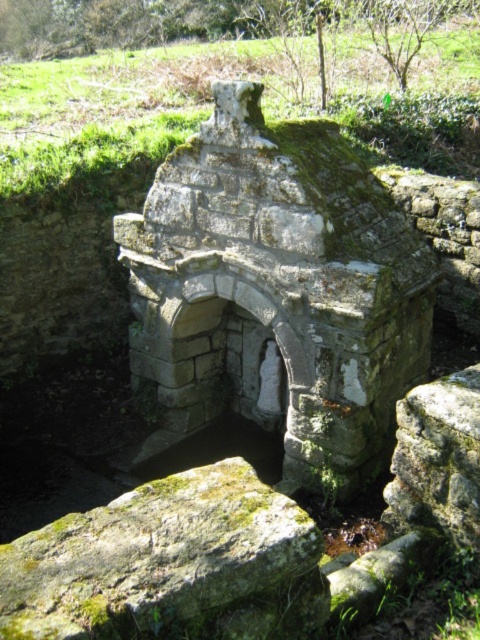
Does green mossy rock at lower left have a greater width compared to green mossy rock at center?

Indeed, green mossy rock at lower left has a greater width compared to green mossy rock at center.

Is green mossy rock at lower left below green mossy rock at center?

Correct, green mossy rock at lower left is located below green mossy rock at center.

Which is behind, point (300, 588) or point (453, 436)?

Positioned behind is point (453, 436).

At what (x,y) coordinates should I click in order to perform the action: click on green mossy rock at lower left. Please return your answer as a coordinate pair (x, y). This screenshot has width=480, height=640. Looking at the image, I should click on (170, 564).

Between green mossy stone at center and green mossy rock at center, which one has more height?

Standing taller between the two is green mossy stone at center.

Image resolution: width=480 pixels, height=640 pixels. What do you see at coordinates (277, 291) in the screenshot?
I see `green mossy stone at center` at bounding box center [277, 291].

What are the coordinates of `green mossy stone at center` in the screenshot? It's located at (277, 291).

How much distance is there between green mossy stone at center and green mossy rock at lower left?

green mossy stone at center is 6.98 feet from green mossy rock at lower left.

Is green mossy stone at center below green mossy rock at lower left?

Actually, green mossy stone at center is above green mossy rock at lower left.

The width and height of the screenshot is (480, 640). Find the location of `green mossy stone at center`. green mossy stone at center is located at coordinates (277, 291).

I want to click on green mossy stone at center, so click(277, 291).